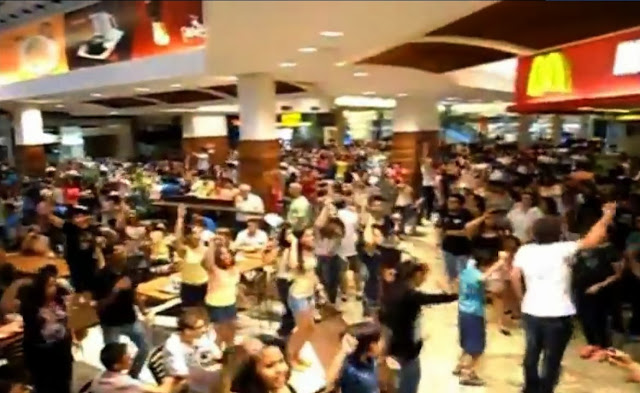
Locate an element on the screen. structural pillar is located at coordinates (209, 140).